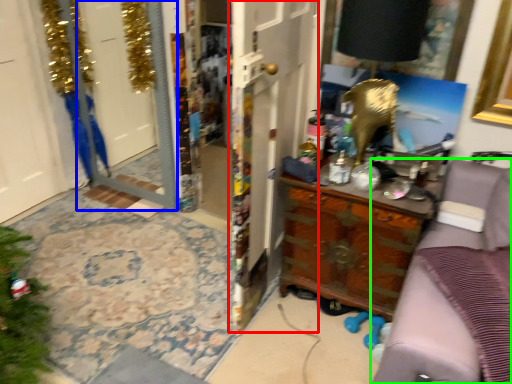
Question: Which is farther away from door (highlighted by a red box)? screen door (highlighted by a blue box) or furniture (highlighted by a green box)?

Choices:
 (A) screen door
 (B) furniture

Answer: (A)